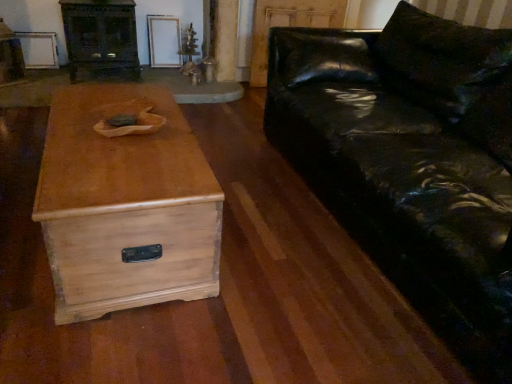
Question: From a real-world perspective, is light wood chest at center physically located above or below dark wood entertainment center at upper left?

Choices:
 (A) below
 (B) above

Answer: (A)

Question: Is light wood chest at center taller or shorter than dark wood entertainment center at upper left?

Choices:
 (A) tall
 (B) short

Answer: (B)

Question: Which is farther from the glossy black leather couch at right?

Choices:
 (A) dark wood entertainment center at upper left
 (B) light wood chest at center

Answer: (A)

Question: Considering the real-world distances, which object is closest to the light wood chest at center?

Choices:
 (A) glossy black leather couch at right
 (B) dark wood entertainment center at upper left

Answer: (A)